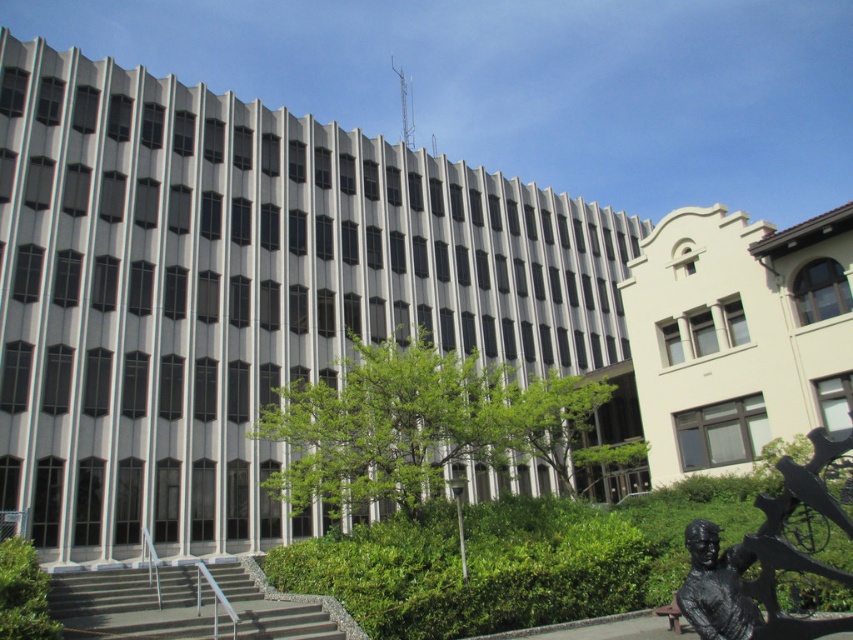
You are standing at the entrance of the building and see the point marked at coordinates (x=764, y=557). What object is located at that point?

The point at coordinates (x=764, y=557) corresponds to the black bronze statue at lower right.

You are an architect visiting the building and want to place a new sculpture between the black bronze statue at lower right and the black polished statue at lower right. Based on their current positions, which direction should you move the new sculpture to ensure it is placed between them?

The black bronze statue at lower right is positioned over the black polished statue at lower right, so to place the new sculpture between them, you should move it downward from the black bronze statue at lower right towards the black polished statue at lower right.

You are standing at the base of the gray concrete stairs at lower left and want to approach the black bronze statue at lower right. Which direction should you move to reach it?

The black bronze statue at lower right is located above the gray concrete stairs at lower left, so you should move upward along the stairs to reach it.